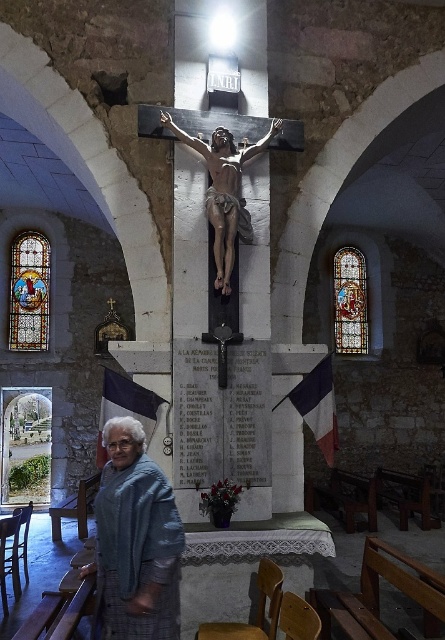
Question: Does matte stone crucifix at center have a smaller size compared to stained glass window at upper center?

Choices:
 (A) no
 (B) yes

Answer: (A)

Question: Estimate the real-world distances between objects in this image. Which object is farther from the stained glass window at upper center?

Choices:
 (A) matte stone crucifix at center
 (B) blue plaid shawl at lower left
 (C) stained glass window at left

Answer: (B)

Question: Considering the real-world distances, which object is closest to the stained glass window at left?

Choices:
 (A) matte stone crucifix at center
 (B) stained glass window at upper center

Answer: (B)

Question: Is stained glass window at left to the left of stained glass window at upper center from the viewer's perspective?

Choices:
 (A) no
 (B) yes

Answer: (B)

Question: Which point is closer to the camera taking this photo?

Choices:
 (A) (40, 339)
 (B) (267, 145)
 (C) (144, 628)

Answer: (C)

Question: Does blue plaid shawl at lower left appear on the right side of stained glass window at left?

Choices:
 (A) no
 (B) yes

Answer: (B)